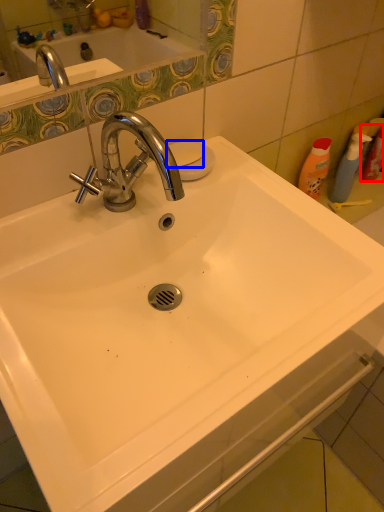
Question: Among these objects, which one is nearest to the camera, cleaning product (highlighted by a red box) or soap (highlighted by a blue box)?

Choices:
 (A) cleaning product
 (B) soap

Answer: (B)